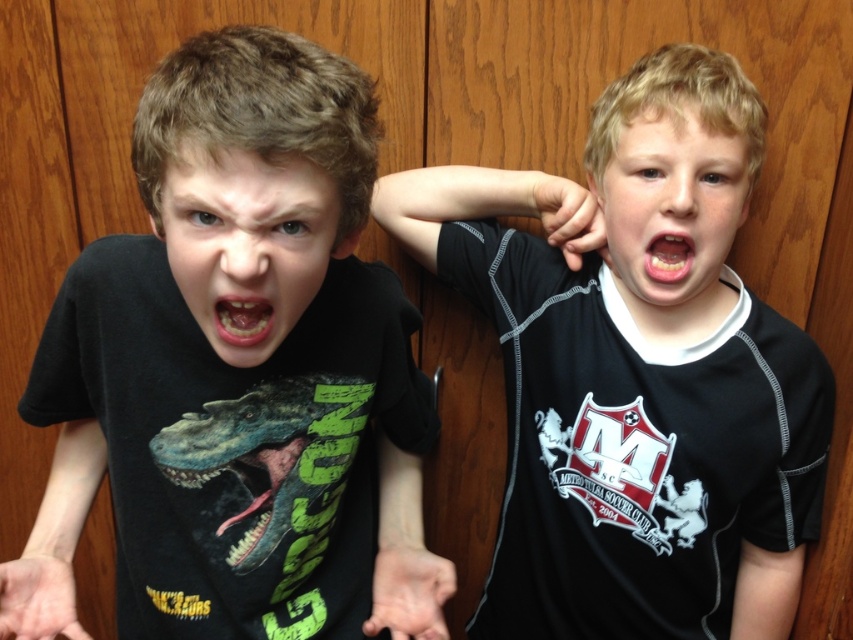
You are a photographer trying to capture a closeup of the black matte t shirt at center. You want to focus on the point at coordinates (234, 368). Is this point located on the black matte t shirt at center?

Yes, the point at coordinates (234, 368) is located on the black matte t shirt at center according to the description.

You are a photographer standing at the camera position. You want to take a closeup photo of the boy on the left wearing the dinosaur graphic T shirt. The camera can focus on objects within 30 inches. Is the point at (676,192) within the focus range?

The point at (676,192) is 31.81 inches away from the camera, which is outside the focus range of 30 inches. The camera cannot focus on this point.